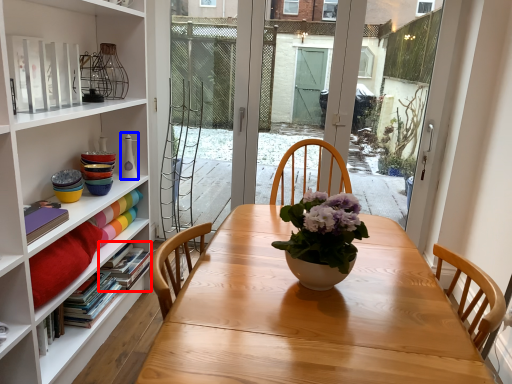
Question: Which point is closer to the camera, book (highlighted by a red box) or vase (highlighted by a blue box)?

Choices:
 (A) book
 (B) vase

Answer: (A)